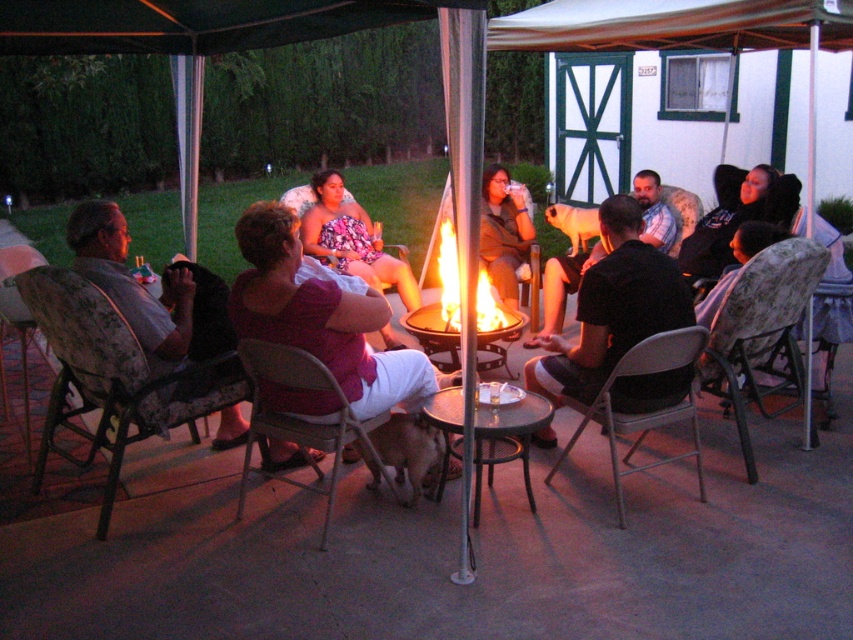
Question: Estimate the real-world distances between objects in this image. Which object is closer to the brown leather jacket at center?

Choices:
 (A) floral fabric chair at left
 (B) pink fabric shirt at center
 (C) matte black shirt at center
 (D) floral fabric chair at lower right

Answer: (D)

Question: Considering the real-world distances, which object is closest to the patterned fabric chair at center?

Choices:
 (A) dark brown hair at upper right
 (B) pink fabric shirt at center
 (C) dark brown shirt at center
 (D) floral fabric chair at lower right

Answer: (D)

Question: Does pink fabric shirt at center appear on the left side of floral fabric chair at left?

Choices:
 (A) yes
 (B) no

Answer: (B)

Question: Does floral-patterned fabric chair at left have a smaller size compared to floral fabric chair at lower right?

Choices:
 (A) yes
 (B) no

Answer: (B)

Question: Can you confirm if matte black shirt at center is positioned to the right of floral fabric dress at center?

Choices:
 (A) yes
 (B) no

Answer: (A)

Question: Based on their relative distances, which object is nearer to the floral-patterned fabric chair at left?

Choices:
 (A) matte black shirt at center
 (B) dark brown hair at upper right
 (C) pink fabric shirt at center
 (D) dark brown shirt at center

Answer: (C)